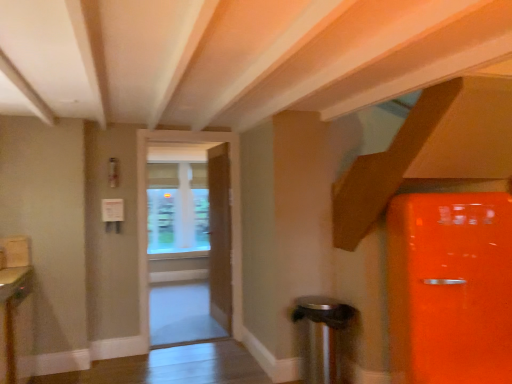
Based on the photo, what is the approximate height of wooden door at center, the 1th door from the back?

6.44 feet.

Where is `matte wood cabinet at lower left`? matte wood cabinet at lower left is located at coordinates 12,312.

This screenshot has width=512, height=384. Find the location of `satin silver trash can at lower right`. satin silver trash can at lower right is located at coordinates (323, 336).

Does transparent glass window at center have a smaller size compared to wooden door at center, the 2th door when ordered from front to back?

No.

Is the depth of transparent glass window at center greater than that of wooden door at center, the 1th door from the back?

That is True.

Considering the relative sizes of transparent glass window at center and wooden door at center, the 2th door when ordered from front to back, in the image provided, is transparent glass window at center taller than wooden door at center, the 2th door when ordered from front to back,?

No, transparent glass window at center is not taller than wooden door at center, the 2th door when ordered from front to back.

Considering the relative sizes of matte wood cabinet at lower left and wooden door at center, the 2th door when ordered from front to back, in the image provided, is matte wood cabinet at lower left smaller than wooden door at center, the 2th door when ordered from front to back,?

Yes, matte wood cabinet at lower left is smaller than wooden door at center, the 2th door when ordered from front to back.

Is matte wood cabinet at lower left outside of wooden door at center, the 1th door from the back?

matte wood cabinet at lower left lies outside wooden door at center, the 1th door from the back,'s area.

Does matte wood cabinet at lower left lie in front of wooden door at center, the 2th door when ordered from front to back?

Yes, matte wood cabinet at lower left is closer to the camera.

Does matte wood cabinet at lower left have a lesser width compared to wooden door at center, the 2th door when ordered from front to back?

No, matte wood cabinet at lower left is not thinner than wooden door at center, the 2th door when ordered from front to back.

Is point (232, 235) positioned behind point (27, 276)?

Yes, point (232, 235) is farther from viewer.

Looking at the image, does white glossy door at center, which is counted as the second door, starting from the back, seem bigger or smaller compared to matte wood cabinet at lower left?

white glossy door at center, which is counted as the second door, starting from the back, is bigger than matte wood cabinet at lower left.

Could matte wood cabinet at lower left be considered to be inside white glossy door at center, which is counted as the second door, starting from the back?

No, white glossy door at center, which is counted as the second door, starting from the back, does not contain matte wood cabinet at lower left.

Consider the image. From a real-world perspective, which object rests below the other?

matte wood cabinet at lower left is physically lower.

Which of these two, transparent glass window at center or matte wood cabinet at lower left, is wider?

matte wood cabinet at lower left is wider.

Considering the sizes of objects transparent glass window at center and matte wood cabinet at lower left in the image provided, who is smaller, transparent glass window at center or matte wood cabinet at lower left?

Smaller between the two is matte wood cabinet at lower left.

How much distance is there between transparent glass window at center and matte wood cabinet at lower left?

A distance of 3.21 meters exists between transparent glass window at center and matte wood cabinet at lower left.

Considering the relative positions of transparent glass window at center and matte wood cabinet at lower left in the image provided, is transparent glass window at center to the left of matte wood cabinet at lower left from the viewer's perspective?

No.

In the image, is transparent glass window at center positioned in front of or behind white glossy door at center, which is counted as the second door, starting from the back?

Visually, transparent glass window at center is located behind white glossy door at center, which is counted as the second door, starting from the back.

How different are the orientations of transparent glass window at center and white glossy door at center, positioned as the first door in front-to-back order, in degrees?

The facing directions of transparent glass window at center and white glossy door at center, positioned as the first door in front-to-back order, are 4.34 degrees apart.

Looking at the image, does transparent glass window at center seem bigger or smaller compared to white glossy door at center, positioned as the first door in front-to-back order?

Considering their sizes, transparent glass window at center takes up less space than white glossy door at center, positioned as the first door in front-to-back order.

From the image's perspective, is transparent glass window at center beneath white glossy door at center, which is counted as the second door, starting from the back?

No.

Is point (167, 135) closer or farther from the camera than point (325, 363)?

Clearly, point (167, 135) is more distant from the camera than point (325, 363).

Image resolution: width=512 pixels, height=384 pixels. I want to click on trash bin/can in front of the white glossy door at center, positioned as the first door in front-to-back order, so click(323, 336).

Is white glossy door at center, positioned as the first door in front-to-back order, at the left side of satin silver trash can at lower right?

Indeed, white glossy door at center, positioned as the first door in front-to-back order, is positioned on the left side of satin silver trash can at lower right.

Which object is positioned more to the left, wooden door at center, the 1th door from the back, or matte wood cabinet at lower left?

matte wood cabinet at lower left is more to the left.

Can you confirm if wooden door at center, the 2th door when ordered from front to back, is smaller than matte wood cabinet at lower left?

No, wooden door at center, the 2th door when ordered from front to back, is not smaller than matte wood cabinet at lower left.

Consider the image. Considering the relative sizes of wooden door at center, the 2th door when ordered from front to back, and matte wood cabinet at lower left in the image provided, is wooden door at center, the 2th door when ordered from front to back, shorter than matte wood cabinet at lower left?

In fact, wooden door at center, the 2th door when ordered from front to back, may be taller than matte wood cabinet at lower left.

From a real-world perspective, which is physically below, wooden door at center, the 1th door from the back, or matte wood cabinet at lower left?

matte wood cabinet at lower left is physically lower.

From a real-world perspective, which door is the 2nd one underneath the transparent glass window at center? Please provide its 2D coordinates.

[(220, 235)]

From the image's perspective, count 1st doors upward from the matte wood cabinet at lower left and point to it. Please provide its 2D coordinates.

[(220, 235)]

When comparing their distances from satin silver trash can at lower right, does wooden door at center, the 1th door from the back, or white glossy door at center, positioned as the first door in front-to-back order, seem further?

Based on the image, wooden door at center, the 1th door from the back, appears to be further to satin silver trash can at lower right.

Considering their positions, is white glossy door at center, which is counted as the second door, starting from the back, positioned closer to wooden door at center, the 2th door when ordered from front to back, than satin silver trash can at lower right?

white glossy door at center, which is counted as the second door, starting from the back.

Based on their spatial positions, is transparent glass window at center or wooden door at center, the 2th door when ordered from front to back, closer to matte wood cabinet at lower left?

Based on the image, wooden door at center, the 2th door when ordered from front to back, appears to be nearer to matte wood cabinet at lower left.

Based on their spatial positions, is white glossy door at center, positioned as the first door in front-to-back order, or satin silver trash can at lower right closer to matte wood cabinet at lower left?

The object closer to matte wood cabinet at lower left is white glossy door at center, positioned as the first door in front-to-back order.

Estimate the real-world distances between objects in this image. Which object is closer to satin silver trash can at lower right, matte wood cabinet at lower left or white glossy door at center, positioned as the first door in front-to-back order?

Based on the image, white glossy door at center, positioned as the first door in front-to-back order, appears to be nearer to satin silver trash can at lower right.

Based on their spatial positions, is satin silver trash can at lower right or wooden door at center, the 1th door from the back, further from white glossy door at center, positioned as the first door in front-to-back order?

satin silver trash can at lower right is further to white glossy door at center, positioned as the first door in front-to-back order.

Which object lies further to the anchor point transparent glass window at center, matte wood cabinet at lower left or wooden door at center, the 2th door when ordered from front to back?

matte wood cabinet at lower left is positioned further to the anchor transparent glass window at center.

Which object lies further to the anchor point matte wood cabinet at lower left, wooden door at center, the 2th door when ordered from front to back, or white glossy door at center, positioned as the first door in front-to-back order?

Among the two, wooden door at center, the 2th door when ordered from front to back, is located further to matte wood cabinet at lower left.

Where is `door between matte wood cabinet at lower left and wooden door at center, the 1th door from the back, in the front-back direction`? The image size is (512, 384). door between matte wood cabinet at lower left and wooden door at center, the 1th door from the back, in the front-back direction is located at coordinates (147, 213).

The width and height of the screenshot is (512, 384). Identify the location of door between white glossy door at center, positioned as the first door in front-to-back order, and transparent glass window at center in the front-back direction. (220, 235).

Find the location of `trash bin/can between matte wood cabinet at lower left and transparent glass window at center along the z-axis`. trash bin/can between matte wood cabinet at lower left and transparent glass window at center along the z-axis is located at coordinates (323, 336).

Locate an element on the screen. door between satin silver trash can at lower right and wooden door at center, the 2th door when ordered from front to back, from front to back is located at coordinates (147, 213).